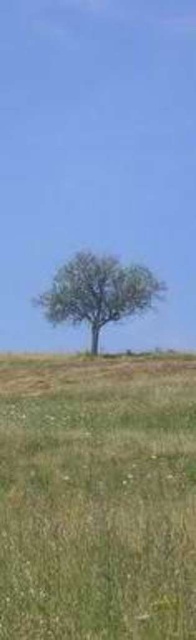
Is green grassy field at center wider than green leafy tree at center?

Incorrect, green grassy field at center's width does not surpass green leafy tree at center's.

Which is in front, point (156, 413) or point (49, 314)?

Point (156, 413)

I want to click on green grassy field at center, so click(97, 497).

Locate an element on the screen. green grassy field at center is located at coordinates (97, 497).